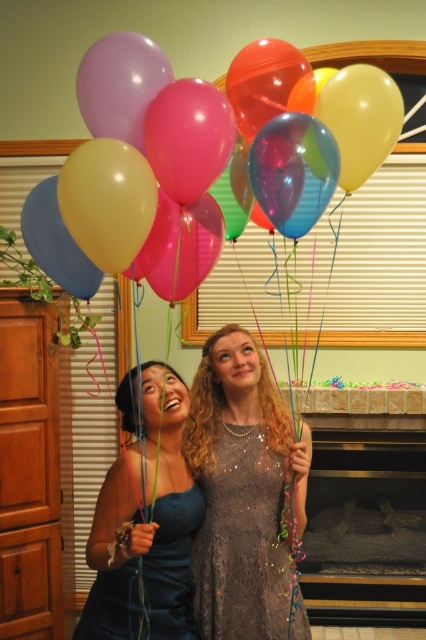
In the scene shown: Does translucent glossy balloons at upper center have a smaller size compared to sequined fabric dress at center?

No, translucent glossy balloons at upper center is not smaller than sequined fabric dress at center.

Can you confirm if translucent glossy balloons at upper center is thinner than sequined fabric dress at center?

No, translucent glossy balloons at upper center is not thinner than sequined fabric dress at center.

Between point (192, 177) and point (204, 616), which one is positioned behind?

The point (204, 616) is behind.

Image resolution: width=426 pixels, height=640 pixels. Identify the location of translucent glossy balloons at upper center. (132, 161).

Which is below, translucent glossy balloons at upper center or dark blue satin dress at lower left?

dark blue satin dress at lower left is lower down.

Where is `translucent glossy balloons at upper center`? translucent glossy balloons at upper center is located at coordinates (132, 161).

Does sequined fabric dress at center appear on the left side of dark blue satin dress at lower left?

No, sequined fabric dress at center is not to the left of dark blue satin dress at lower left.

Can you confirm if sequined fabric dress at center is thinner than dark blue satin dress at lower left?

Yes.

This screenshot has height=640, width=426. Identify the location of sequined fabric dress at center. (x=241, y=540).